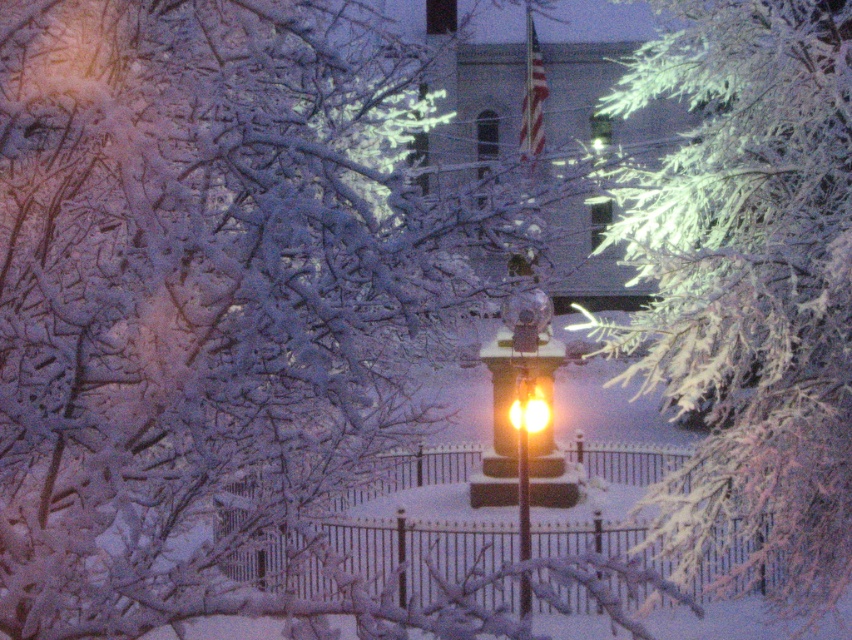
You are an artist planning to sketch this winter scene. You want to ensure the icy white branches at upper right and the metallic iron fence at center are proportionally accurate. Which object should you draw larger in your sketch?

The icy white branches at upper right should be drawn larger than the metallic iron fence at center because they are described as having a larger size compared to the fence.

You are standing at the streetlamp and want to walk towards the point at coordinates point [792,292]. Which direction should you go relative to the point at coordinates point [515,406]?

Since point [792,292] is in front of point [515,406], you should walk towards the direction of point [792,292], which is ahead of point [515,406].

You are a photographer setting up equipment in the winter scene. You need to place a tripod between the metallic iron fence at center and the yellow glass streetlight at center. Which object should you position the tripod closer to if you want it to be near the larger object?

The metallic iron fence at center is bigger than the yellow glass streetlight at center, so you should position the tripod closer to the metallic iron fence at center.